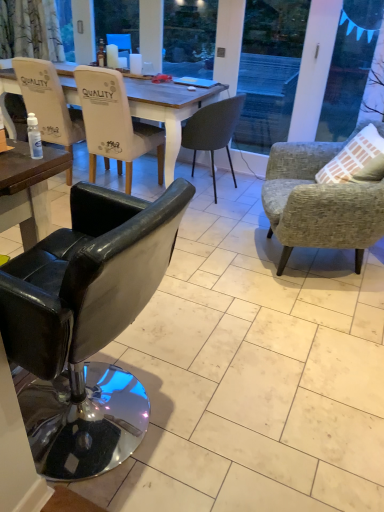
The image size is (384, 512). In order to click on vacant space behind black leather chair at left, arranged as the third chair when viewed from the right in this screenshot , I will do `click(167, 336)`.